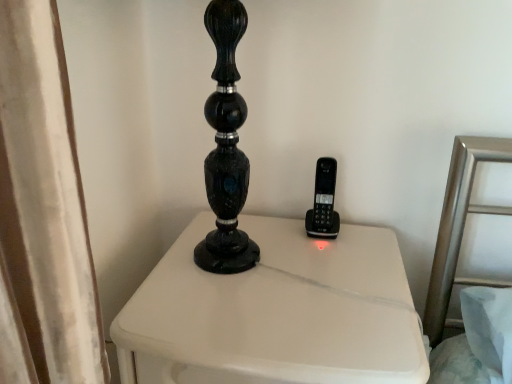
Question: Which is correct: black plastic phone at center is inside white painted wood nightstand at center, or outside of it?

Choices:
 (A) inside
 (B) outside

Answer: (B)

Question: Is point (315, 182) closer or farther from the camera than point (194, 360)?

Choices:
 (A) farther
 (B) closer

Answer: (A)

Question: Relative to white painted wood nightstand at center, is black plastic phone at center in front or behind?

Choices:
 (A) behind
 (B) front

Answer: (A)

Question: Is white painted wood nightstand at center taller or shorter than black plastic phone at center?

Choices:
 (A) short
 (B) tall

Answer: (B)

Question: Is point (396, 253) positioned closer to the camera than point (314, 221)?

Choices:
 (A) closer
 (B) farther

Answer: (A)

Question: Considering the positions of white painted wood nightstand at center and black plastic phone at center in the image, is white painted wood nightstand at center wider or thinner than black plastic phone at center?

Choices:
 (A) wide
 (B) thin

Answer: (A)

Question: Do you think white painted wood nightstand at center is within black plastic phone at center, or outside of it?

Choices:
 (A) inside
 (B) outside

Answer: (B)